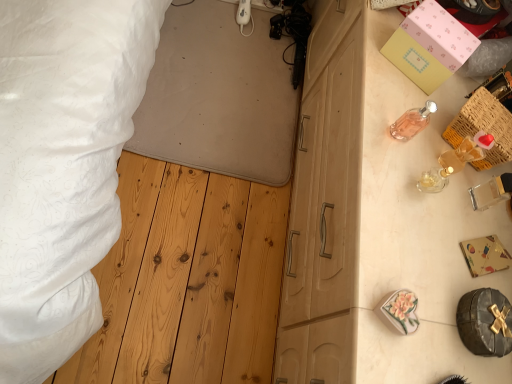
Locate an element on the screen. Image resolution: width=512 pixels, height=384 pixels. vacant area that lies between gold foil gift box at right, positioned as the first box in front-to-back order, and woven wood crate at upper right is located at coordinates (473, 198).